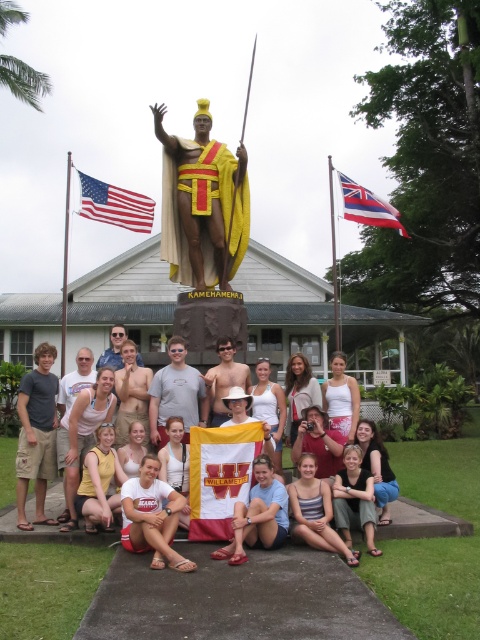
Question: Can you confirm if blue cotton shirt at center is positioned below matte black sunglasses at center?

Choices:
 (A) no
 (B) yes

Answer: (B)

Question: Is shiny gold necklace at center positioned in front of tan skin shirtless man at center?

Choices:
 (A) yes
 (B) no

Answer: (A)

Question: Can you confirm if gray t-shirt at center is positioned above shiny gold necklace at center?

Choices:
 (A) yes
 (B) no

Answer: (B)

Question: Which object appears closest to the camera in this image?

Choices:
 (A) american flag at upper left
 (B) matte black sunglasses at center
 (C) tan cargo shorts at center

Answer: (C)

Question: Which object is the closest to the white cotton t-shirt at center?

Choices:
 (A) tan skin shirtless man at center
 (B) blue cotton shirt at center

Answer: (B)

Question: Based on their relative distances, which object is farther from the gray t-shirt at center?

Choices:
 (A) white cotton shirt at center
 (B) matte black sunglasses at center
 (C) tan skin shirtless man at center
 (D) american flag at upper left

Answer: (D)